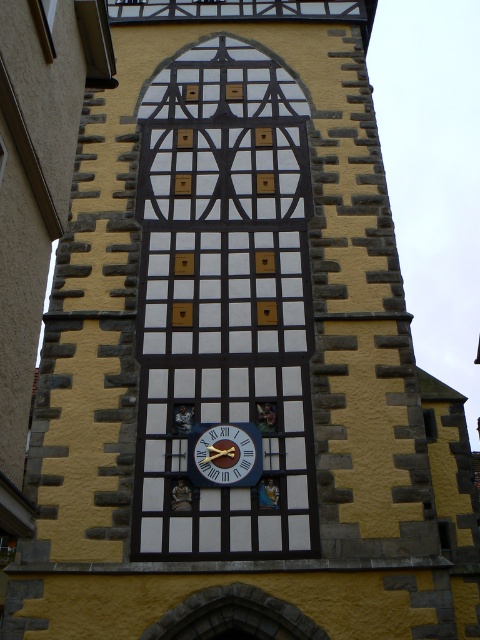
You are an architect analyzing the building structure. You need to locate the white painted wood at center. Where is it positioned in the image?

The white painted wood at center is located at point coordinates of 0.473 on the x axis and 0.467 on the y axis.

You are an architect examining the building design. You notice the white painted wood at center and the blue painted wood clock at center. Which one is positioned higher in the structure?

The white painted wood at center is located above the blue painted wood clock at center, so it is positioned higher in the structure.